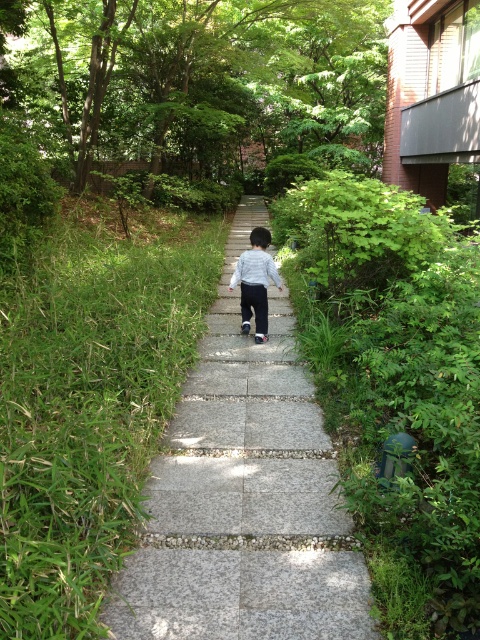
Does gray concrete pavement at center appear on the right side of light gray cotton shirt at center?

In fact, gray concrete pavement at center is to the left of light gray cotton shirt at center.

Who is positioned more to the right, gray concrete pavement at center or light gray cotton shirt at center?

light gray cotton shirt at center

Locate an element on the screen. gray concrete pavement at center is located at coordinates [x=243, y=497].